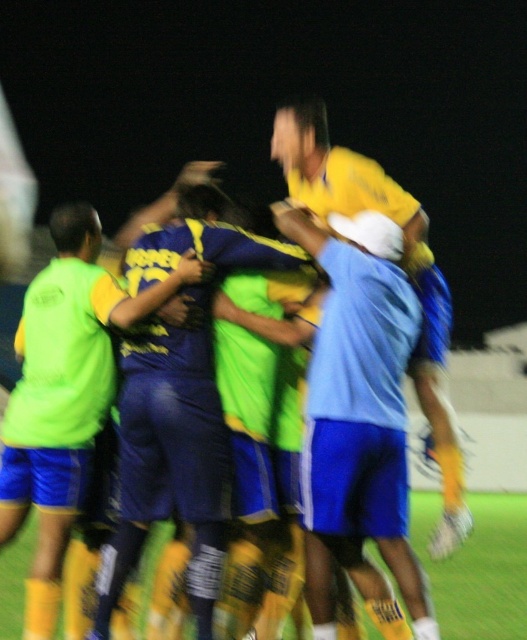
Question: Which object appears farthest from the camera in this image?

Choices:
 (A) yellow matte jersey at center
 (B) green grass at center
 (C) neon green jersey at left

Answer: (B)

Question: Which point is farther from the camera taking this photo?

Choices:
 (A) (326, 180)
 (B) (198, 509)
 (C) (375, 557)

Answer: (C)

Question: Observing the image, what is the correct spatial positioning of blue jersey at center in reference to yellow matte jersey at center?

Choices:
 (A) right
 (B) left

Answer: (B)

Question: From the image, what is the correct spatial relationship of neon green jersey at left in relation to green grass at center?

Choices:
 (A) below
 (B) above

Answer: (B)

Question: Which object appears closest to the camera in this image?

Choices:
 (A) neon green jersey at left
 (B) blue jersey at center
 (C) green grass at center

Answer: (B)

Question: Can you confirm if blue jersey at center is positioned to the right of neon green jersey at left?

Choices:
 (A) no
 (B) yes

Answer: (B)